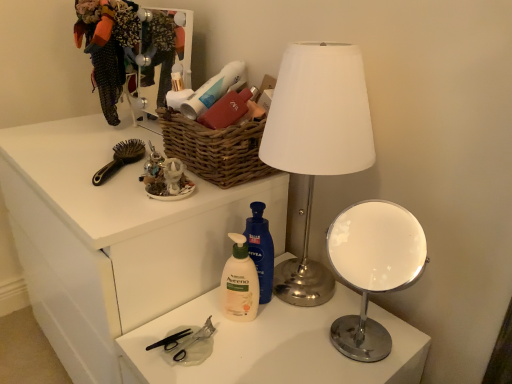
This screenshot has width=512, height=384. I want to click on unoccupied space behind black plastic scissors at lower center, so click(202, 315).